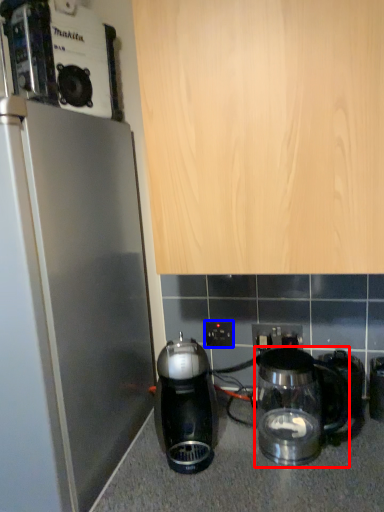
Question: Which object appears closest to the camera in this image, kitchen appliance (highlighted by a red box) or electric outlet (highlighted by a blue box)?

Choices:
 (A) kitchen appliance
 (B) electric outlet

Answer: (A)